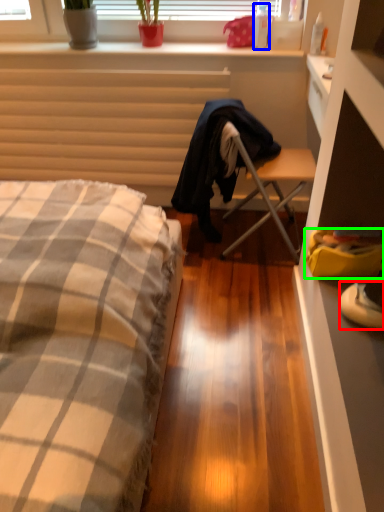
Question: Estimate the real-world distances between objects in this image. Which object is farther from sneakers (highlighted by a red box), bottle (highlighted by a blue box) or handbag (highlighted by a green box)?

Choices:
 (A) bottle
 (B) handbag

Answer: (A)